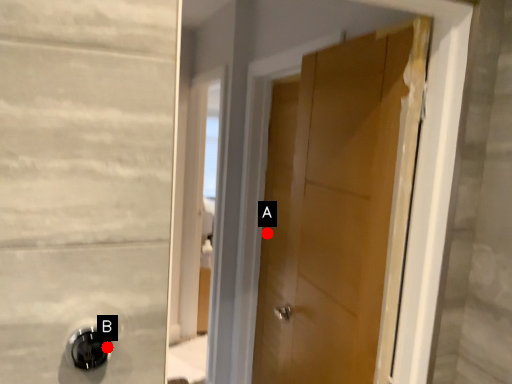
Question: Two points are circled on the image, labeled by A and B beside each circle. Which point appears closest to the camera in this image?

Choices:
 (A) A is closer
 (B) B is closer

Answer: (B)